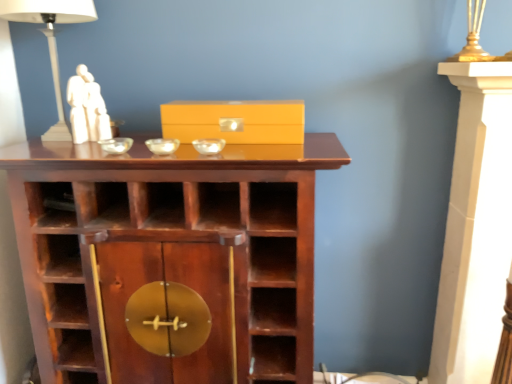
At what (x,y) coordinates should I click in order to perform the action: click on unoccupied area behind transparent glass bowl at center, the third glass bowl in the left-to-right sequence. Please return your answer as a coordinate pair (x, y). The width and height of the screenshot is (512, 384). Looking at the image, I should click on [207, 138].